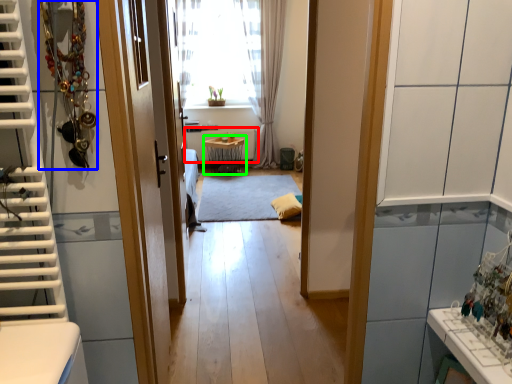
Question: Estimate the real-world distances between objects in this image. Which object is closer to radiator (highlighted by a red box), necklace (highlighted by a blue box) or table (highlighted by a green box)?

Choices:
 (A) necklace
 (B) table

Answer: (B)